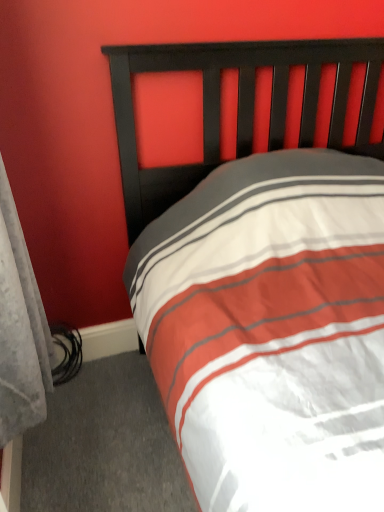
What do you see at coordinates (20, 328) in the screenshot? I see `velvet gray curtain at left` at bounding box center [20, 328].

The height and width of the screenshot is (512, 384). In order to click on velvet gray curtain at left in this screenshot , I will do `click(20, 328)`.

From the picture: What is the approximate height of velvet gray curtain at left?

The height of velvet gray curtain at left is 29.64 inches.

Identify the location of velvet gray curtain at left. [20, 328].